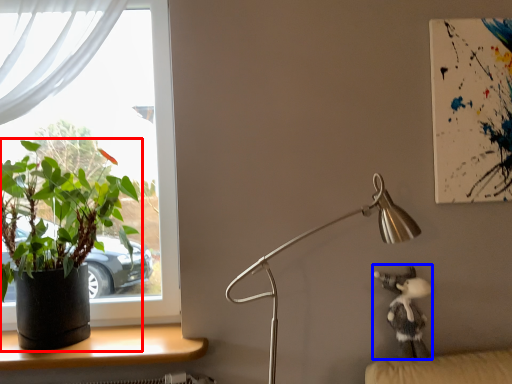
Question: Among these objects, which one is farthest to the camera, houseplant (highlighted by a red box) or toy (highlighted by a blue box)?

Choices:
 (A) houseplant
 (B) toy

Answer: (B)